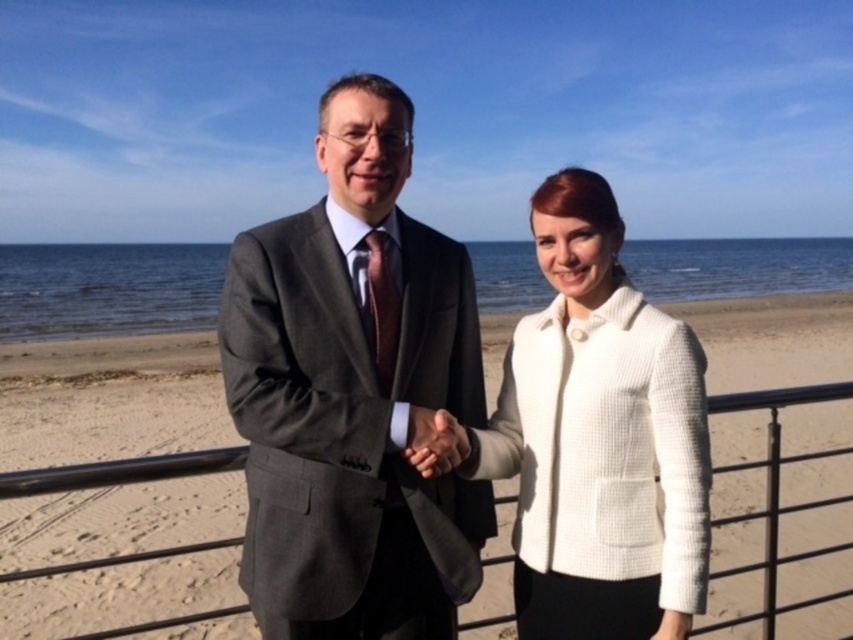
Question: Which object is closer to the camera taking this photo?

Choices:
 (A) sandy beach at center
 (B) gray wool suit at center

Answer: (A)

Question: Is sandy beach at center thinner than white textured jacket at center?

Choices:
 (A) yes
 (B) no

Answer: (B)

Question: Which point appears closest to the camera in this image?

Choices:
 (A) (247, 470)
 (B) (432, 445)
 (C) (741, 413)

Answer: (B)

Question: Does gray wool suit at center have a larger size compared to smooth skin hand at center?

Choices:
 (A) no
 (B) yes

Answer: (B)

Question: Among these points, which one is farthest from the camera?

Choices:
 (A) (403, 470)
 (B) (57, 368)
 (C) (460, 460)

Answer: (B)

Question: Does gray wool suit at center have a greater width compared to sandy beach at center?

Choices:
 (A) no
 (B) yes

Answer: (A)